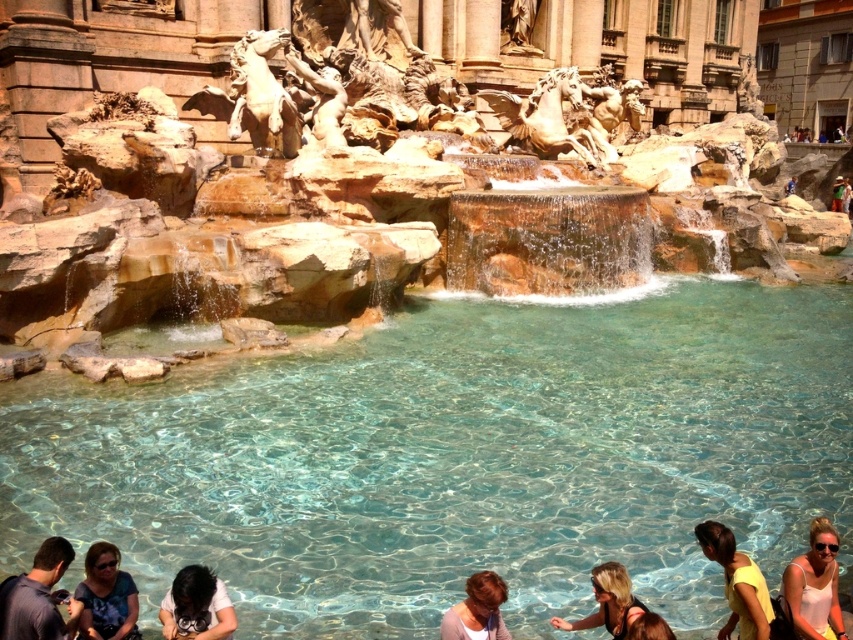
Between yellow matte shirt at lower right and brown leather bag at lower center, which one is positioned lower?

brown leather bag at lower center is lower down.

Is point (695, 532) farther from camera compared to point (650, 612)?

That is True.

Is point (752, 573) more distant than point (642, 618)?

That is True.

Image resolution: width=853 pixels, height=640 pixels. Identify the location of yellow matte shirt at lower right. (737, 582).

Does dark gray shirt at lower left have a lesser width compared to light brown hair at lower center?

In fact, dark gray shirt at lower left might be wider than light brown hair at lower center.

Between dark gray shirt at lower left and light brown hair at lower center, which one is positioned higher?

Positioned higher is dark gray shirt at lower left.

This screenshot has width=853, height=640. What do you see at coordinates (38, 596) in the screenshot?
I see `dark gray shirt at lower left` at bounding box center [38, 596].

You are a GUI agent. You are given a task and a screenshot of the screen. Output one action in this format:
    pyautogui.click(x=<x>, y=<y>)
    Task: Click on the dark gray shirt at lower left
    The height and width of the screenshot is (640, 853).
    Given the screenshot: What is the action you would take?
    pyautogui.click(x=38, y=596)

Who is lower down, black swimsuit at lower center or brown leather bag at lower center?

black swimsuit at lower center is lower down.

Is black swimsuit at lower center to the left of brown leather bag at lower center from the viewer's perspective?

Correct, you'll find black swimsuit at lower center to the left of brown leather bag at lower center.

This screenshot has height=640, width=853. In order to click on black swimsuit at lower center in this screenshot , I will do `click(608, 602)`.